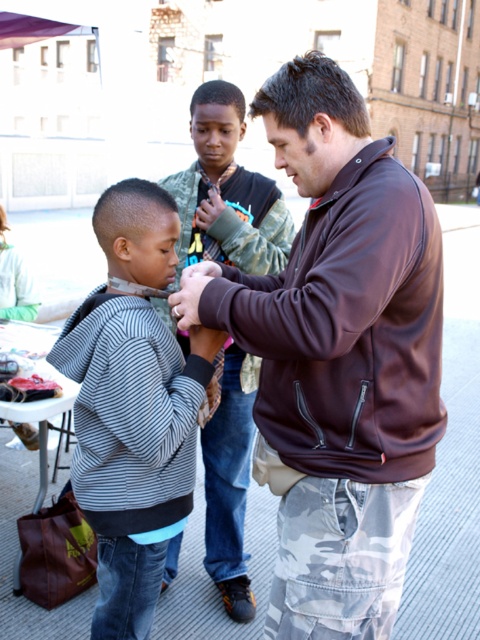
You are standing in the urban area shown in the image and want to walk from point [289,280] to point [218,468]. Since you can only move forward, will you have to walk towards or away from the camera to reach your destination?

You will have to walk away from the camera to reach point [218,468] because point [289,280] is closer to the camera than point [218,468].

You are a fashion designer observing two striped clothing items in the image. Which one is shorter in height between the striped cotton sweatshirt at center and the striped fabric shirt at center?

The striped cotton sweatshirt at center has a lesser height compared to the striped fabric shirt at center, so the striped cotton sweatshirt at center is shorter in height.